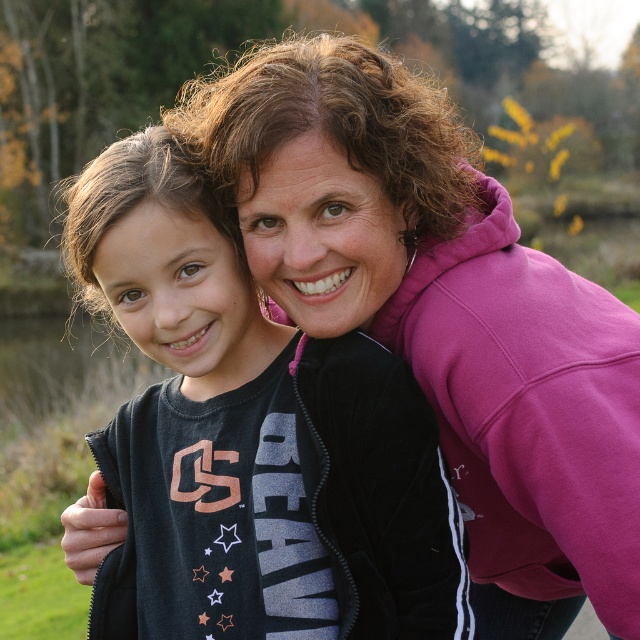
Question: Which point is farther from the camera taking this photo?

Choices:
 (A) (257, 525)
 (B) (179, 109)

Answer: (B)

Question: Does pink fleece at upper right have a lesser width compared to black matte jacket at center?

Choices:
 (A) no
 (B) yes

Answer: (A)

Question: Can you confirm if pink fleece at upper right is positioned to the right of black matte jacket at center?

Choices:
 (A) no
 (B) yes

Answer: (A)

Question: Which object is farther from the camera taking this photo?

Choices:
 (A) black matte jacket at center
 (B) pink fleece at upper right

Answer: (A)

Question: Which object appears farthest from the camera in this image?

Choices:
 (A) pink fleece at upper right
 (B) black matte jacket at center

Answer: (B)

Question: In this image, where is pink fleece at upper right located relative to black matte jacket at center?

Choices:
 (A) below
 (B) above

Answer: (B)